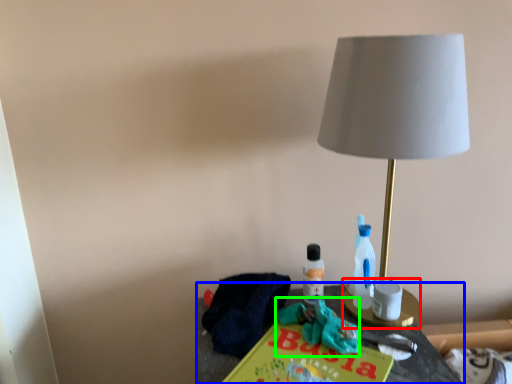
Question: Which object is positioned closest to candle holder (highlighted by a red box)? Select from table (highlighted by a blue box) and scrub (highlighted by a green box).

Choices:
 (A) table
 (B) scrub

Answer: (A)